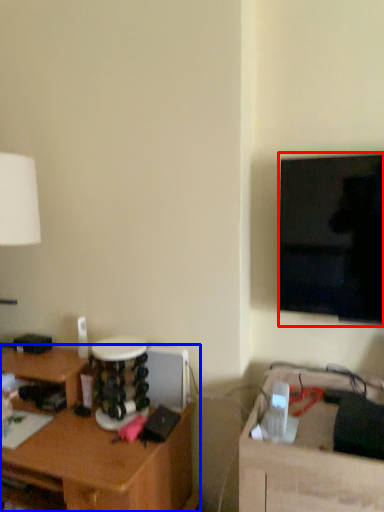
Question: Which object is further to the camera taking this photo, television (highlighted by a red box) or desk (highlighted by a blue box)?

Choices:
 (A) television
 (B) desk

Answer: (A)